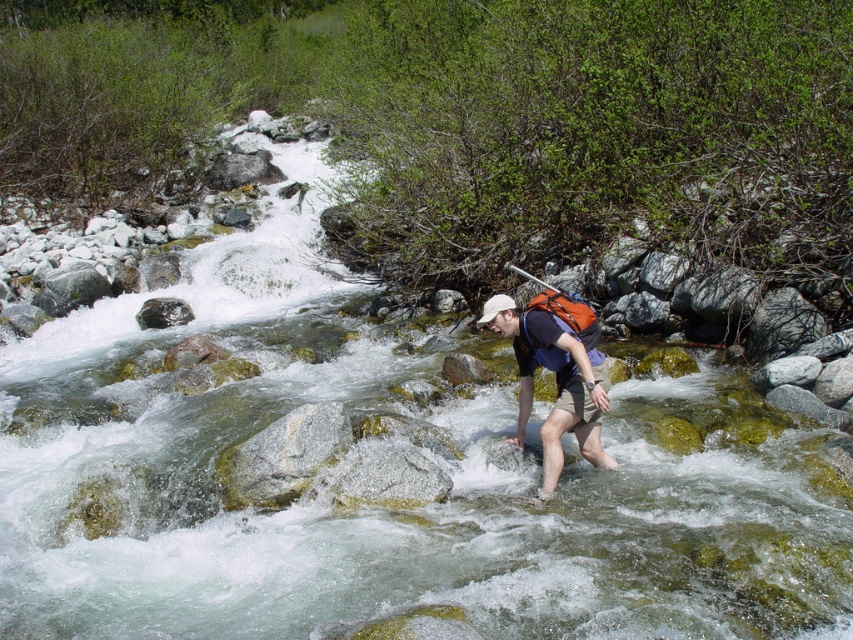
You are a hiker who needs to retrieve your orange fabric paddle at center from the river. Your matte black backpack at center is currently on the ground. Can you safely reach the paddle without moving the backpack?

The distance between the matte black backpack at center and the orange fabric paddle at center is 5.16 meters. Since the river is fast moving with strong currents, it would be unsafe to attempt reaching 5.16 meters into the river. You should find a safer method to retrieve the paddle.

You are a hiker who has just spotted the matte black backpack at center in the river. You want to retrieve it before it floats away. Which direction should you move relative to your current position to reach it?

The matte black backpack at center is located at point (556, 381), so you should move towards the center of the river to retrieve it.

You are the person in the river. You want to reach the point marked as point (563, 291). Which direction should you move relative to your current position at point (529, 364)?

You should move backward because point (529, 364) is in front of point (563, 291), so to reach the latter, you need to go in the opposite direction.